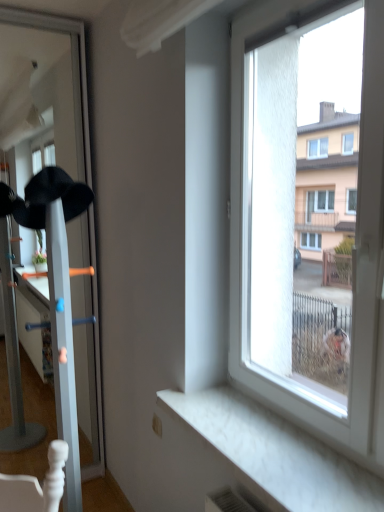
What is the approximate width of white glossy coat rack at left?

It is 15.22 inches.

Find the location of a particular element. Image resolution: width=384 pixels, height=512 pixels. black matte baseball hat at left is located at coordinates (52, 197).

Choose the correct answer: Is black matte baseball hat at left inside white marble window sill at lower right or outside it?

black matte baseball hat at left is located beyond the bounds of white marble window sill at lower right.

Is black matte baseball hat at left turned away from white marble window sill at lower right?

No.

How far apart are black matte baseball hat at left and white marble window sill at lower right?

black matte baseball hat at left and white marble window sill at lower right are 39.36 inches apart from each other.

Which object is positioned more to the right, black matte baseball hat at left or white marble window sill at lower right?

Positioned to the right is white marble window sill at lower right.

Relative to black matte baseball hat at left, is white marble window sill at lower right in front or behind?

white marble window sill at lower right is positioned closer to the viewer than black matte baseball hat at left.

Consider the image. How distant is white marble window sill at lower right from black matte baseball hat at left?

They are 39.36 inches apart.

Between white marble window sill at lower right and black matte baseball hat at left, which one appears on the right side from the viewer's perspective?

white marble window sill at lower right is more to the right.

From a real-world perspective, is white marble window sill at lower right physically located above or below black matte baseball hat at left?

In terms of real-world spatial position, white marble window sill at lower right is below black matte baseball hat at left.

From a real-world perspective, is white glossy coat rack at left located higher than black matte baseball hat at left?

No, from a real-world perspective, white glossy coat rack at left is not above black matte baseball hat at left.

From the image's perspective, who appears lower, white glossy coat rack at left or black matte baseball hat at left?

white glossy coat rack at left, from the image's perspective.

Does point (30, 19) appear closer or farther from the camera than point (33, 200)?

Point (30, 19).

Does point (16, 23) come behind point (340, 486)?

Yes.

Which object is positioned more to the right, white glossy coat rack at left or white marble window sill at lower right?

From the viewer's perspective, white marble window sill at lower right appears more on the right side.

Is white marble window sill at lower right completely or partially inside white glossy coat rack at left?

No, white glossy coat rack at left does not contain white marble window sill at lower right.

From a real-world perspective, does white glossy coat rack at left sit lower than white marble window sill at lower right?

No, from a real-world perspective, white glossy coat rack at left is not below white marble window sill at lower right.

Is white marble window sill at lower right placed right next to white glossy coat rack at left?

No.

Is white marble window sill at lower right positioned beyond the bounds of white glossy coat rack at left?

Yes.

Is the position of white marble window sill at lower right less distant than that of white glossy coat rack at left?

Yes, it is in front of white glossy coat rack at left.

Can we say black matte baseball hat at left lies outside white glossy coat rack at left?

No, most part of black matte baseball hat at left lies within white glossy coat rack at left.

Is black matte baseball hat at left oriented towards white glossy coat rack at left?

Yes.

Considering the relative positions of black matte baseball hat at left and white glossy coat rack at left in the image provided, is black matte baseball hat at left to the right of white glossy coat rack at left from the viewer's perspective?

No, black matte baseball hat at left is not to the right of white glossy coat rack at left.

Is black matte baseball hat at left not near white glossy coat rack at left?

No.

The image size is (384, 512). Identify the location of baseball hat lying behind the white marble window sill at lower right. (52, 197).

At what (x,y) coordinates should I click in order to perform the action: click on window sill below the black matte baseball hat at left (from the image's perspective). Please return your answer as a coordinate pair (x, y). This screenshot has width=384, height=512. Looking at the image, I should click on (275, 454).

Looking at the image, which one is located closer to white marble window sill at lower right, black matte baseball hat at left or white glossy coat rack at left?

Among the two, black matte baseball hat at left is located nearer to white marble window sill at lower right.

Looking at the image, which one is located further to white glossy coat rack at left, black matte baseball hat at left or white marble window sill at lower right?

white marble window sill at lower right lies further to white glossy coat rack at left than the other object.

Estimate the real-world distances between objects in this image. Which object is closer to white marble window sill at lower right, white glossy coat rack at left or black matte baseball hat at left?

black matte baseball hat at left.

From the image, which object appears to be farther from white glossy coat rack at left, white marble window sill at lower right or black matte baseball hat at left?

white marble window sill at lower right lies further to white glossy coat rack at left than the other object.

From the image, which object appears to be farther from black matte baseball hat at left, white marble window sill at lower right or white glossy coat rack at left?

white marble window sill at lower right.

Looking at the image, which one is located closer to black matte baseball hat at left, white glossy coat rack at left or white marble window sill at lower right?

white glossy coat rack at left is positioned closer to the anchor black matte baseball hat at left.

Where is `screen door between black matte baseball hat at left and white marble window sill at lower right vertically`? screen door between black matte baseball hat at left and white marble window sill at lower right vertically is located at coordinates (78, 61).